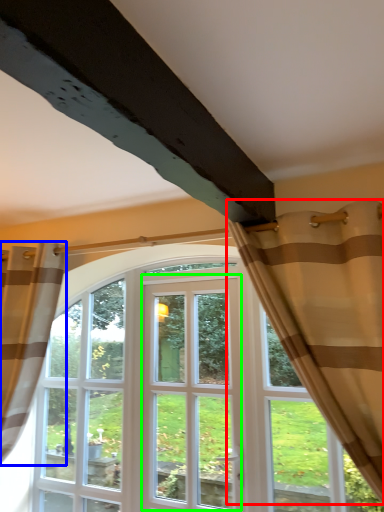
Question: Which object is positioned farthest from curtain (highlighted by a red box)? Select from curtain (highlighted by a blue box) and screen door (highlighted by a green box).

Choices:
 (A) curtain
 (B) screen door

Answer: (A)